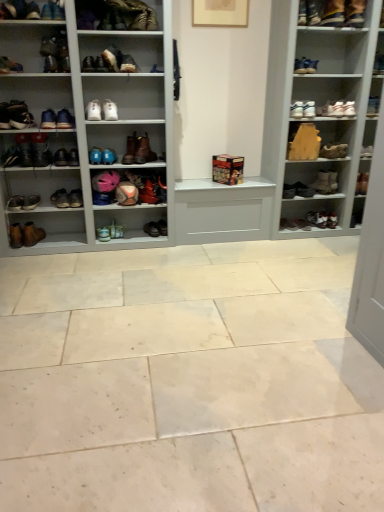
Locate an element on the screen. The height and width of the screenshot is (512, 384). free space above brown leather boot at center, acting as the tenth shoe starting from the right (from a real-world perspective) is located at coordinates (134, 133).